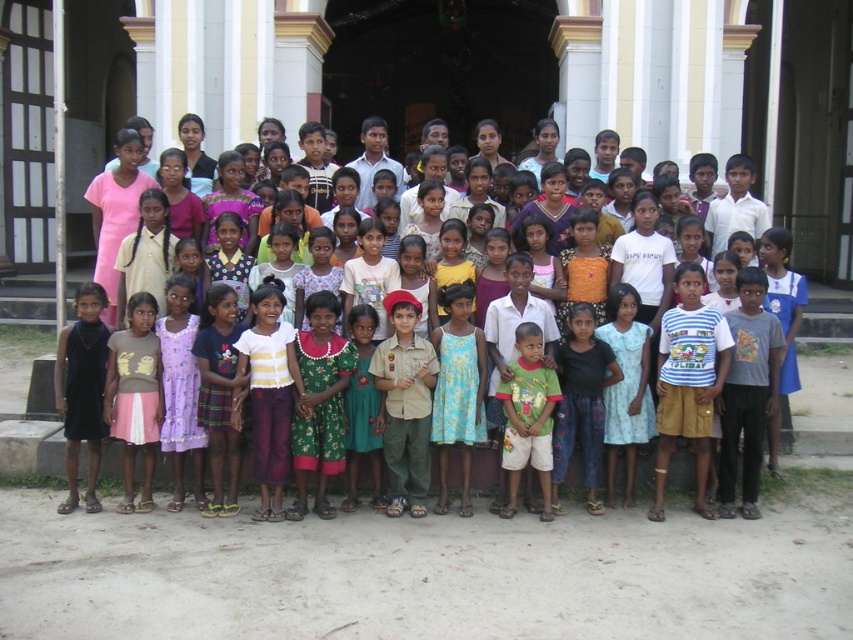
Question: Can you confirm if green dress at center is smaller than green cotton shirt at center?

Choices:
 (A) no
 (B) yes

Answer: (A)

Question: Can you confirm if green dress at center is wider than green cotton shirt at center?

Choices:
 (A) no
 (B) yes

Answer: (B)

Question: Which of the following is the closest to the observer?

Choices:
 (A) (621, 243)
 (B) (527, 413)

Answer: (B)

Question: Does green dress at center appear over green cotton shirt at center?

Choices:
 (A) yes
 (B) no

Answer: (A)